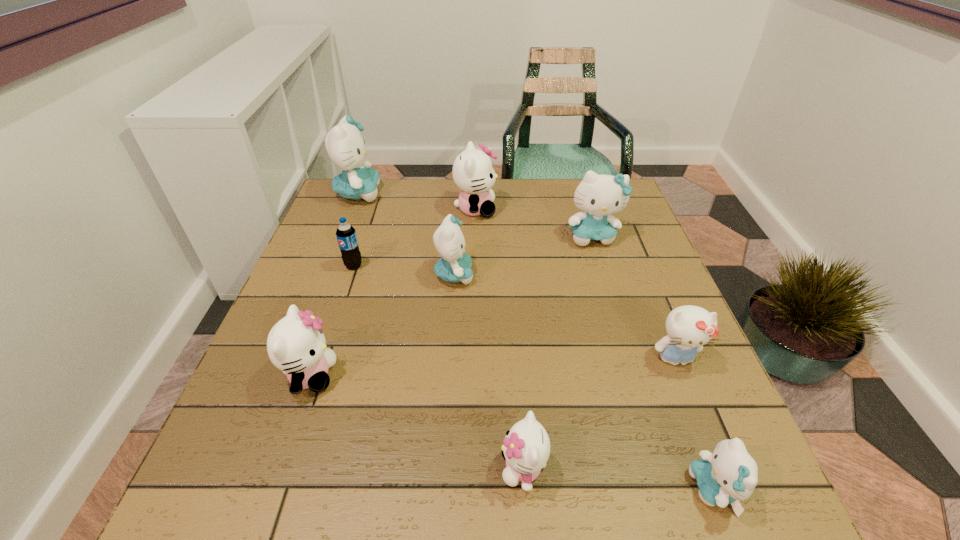
At what (x,y) coordinates should I click in order to perform the action: click on vacant point that satisfies the following two spatial constraints: 1. on the face of the third smallest blue kitten; 2. on the front-facing side of the second smallest white kitten. Please return your answer as a coordinate pair (x, y). The height and width of the screenshot is (540, 960). Looking at the image, I should click on (636, 375).